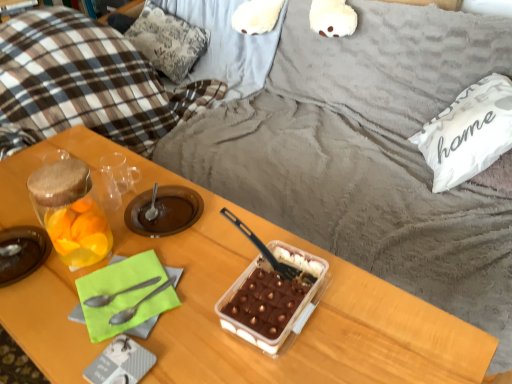
Identify the location of vacant space in front of silver metallic spoon at center, the second spoon when ordered from left to right. (143, 348).